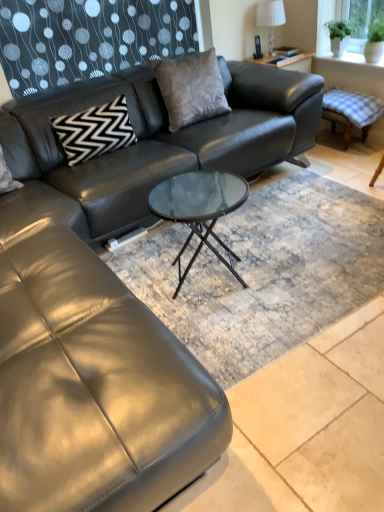
At what (x,y) coordinates should I click in order to perform the action: click on white fabric lampshade at upper right. Please return your answer as a coordinate pair (x, y). This screenshot has width=384, height=512. Looking at the image, I should click on pos(270,18).

What do you see at coordinates (350, 111) in the screenshot? I see `checkered fabric swivel chair at right` at bounding box center [350, 111].

Image resolution: width=384 pixels, height=512 pixels. What do you see at coordinates (191, 88) in the screenshot?
I see `satin gray pillow at center, which ranks as the first pillow in right-to-left order` at bounding box center [191, 88].

Image resolution: width=384 pixels, height=512 pixels. I want to click on green glass window screen at upper right, so click(x=362, y=15).

What do you see at coordinates (94, 131) in the screenshot?
I see `black zigzag-patterned pillow at upper left, positioned as the 1th pillow in left-to-right order` at bounding box center [94, 131].

Where is `white fabric lampshade at upper right`? The height and width of the screenshot is (512, 384). white fabric lampshade at upper right is located at coordinates (270, 18).

Is white fabric lampshade at upper right outside of satin gray pillow at center, which ranks as the first pillow in right-to-left order?

Yes, white fabric lampshade at upper right is outside of satin gray pillow at center, which ranks as the first pillow in right-to-left order.

Between white fabric lampshade at upper right and satin gray pillow at center, which appears as the 2th pillow when viewed from the left, which one has smaller size?

white fabric lampshade at upper right is smaller.

Can you confirm if white fabric lampshade at upper right is shorter than satin gray pillow at center, which appears as the 2th pillow when viewed from the left?

Correct, white fabric lampshade at upper right is not as tall as satin gray pillow at center, which appears as the 2th pillow when viewed from the left.

In the scene shown: Is white fabric lampshade at upper right oriented towards satin gray pillow at center, which appears as the 2th pillow when viewed from the left?

No, white fabric lampshade at upper right is not aimed at satin gray pillow at center, which appears as the 2th pillow when viewed from the left.

From a real-world perspective, is green glass window screen at upper right physically located above or below white fabric lampshade at upper right?

green glass window screen at upper right is situated lower than white fabric lampshade at upper right in the real world.

From their relative heights in the image, would you say green glass window screen at upper right is taller or shorter than white fabric lampshade at upper right?

Considering their sizes, green glass window screen at upper right has less height than white fabric lampshade at upper right.

From the image's perspective, who appears lower, green glass window screen at upper right or white fabric lampshade at upper right?

green glass window screen at upper right.

Is green glass window screen at upper right not within white fabric lampshade at upper right?

Yes, green glass window screen at upper right is located beyond the bounds of white fabric lampshade at upper right.

Is point (267, 7) closer or farther from the camera than point (358, 24)?

Point (267, 7) is positioned farther from the camera compared to point (358, 24).

Considering the sizes of white fabric lampshade at upper right and green glass window screen at upper right in the image, is white fabric lampshade at upper right wider or thinner than green glass window screen at upper right?

Considering their sizes, white fabric lampshade at upper right looks broader than green glass window screen at upper right.

Considering the positions of objects checkered fabric swivel chair at right and satin gray pillow at center, which appears as the 2th pillow when viewed from the left, in the image provided, who is more to the right, checkered fabric swivel chair at right or satin gray pillow at center, which appears as the 2th pillow when viewed from the left,?

checkered fabric swivel chair at right is more to the right.

Which is behind, checkered fabric swivel chair at right or satin gray pillow at center, which ranks as the first pillow in right-to-left order?

checkered fabric swivel chair at right.

Is checkered fabric swivel chair at right next to satin gray pillow at center, which ranks as the first pillow in right-to-left order, and touching it?

checkered fabric swivel chair at right and satin gray pillow at center, which ranks as the first pillow in right-to-left order, are not in contact.

The height and width of the screenshot is (512, 384). I want to click on swivel chair below the satin gray pillow at center, which appears as the 2th pillow when viewed from the left (from the image's perspective), so click(x=350, y=111).

Is black zigzag-patterned pillow at upper left, positioned as the 1th pillow in left-to-right order, to the right of checkered fabric swivel chair at right from the viewer's perspective?

In fact, black zigzag-patterned pillow at upper left, positioned as the 1th pillow in left-to-right order, is to the left of checkered fabric swivel chair at right.

Who is shorter, black zigzag-patterned pillow at upper left, marked as the 2th pillow in a right-to-left arrangement, or checkered fabric swivel chair at right?

Standing shorter between the two is checkered fabric swivel chair at right.

Choose the correct answer: Is black zigzag-patterned pillow at upper left, marked as the 2th pillow in a right-to-left arrangement, inside checkered fabric swivel chair at right or outside it?

black zigzag-patterned pillow at upper left, marked as the 2th pillow in a right-to-left arrangement, is outside checkered fabric swivel chair at right.

Measure the distance between black zigzag-patterned pillow at upper left, positioned as the 1th pillow in left-to-right order, and checkered fabric swivel chair at right.

The distance of black zigzag-patterned pillow at upper left, positioned as the 1th pillow in left-to-right order, from checkered fabric swivel chair at right is 1.72 meters.

In the scene shown: From a real-world perspective, between checkered fabric swivel chair at right and black zigzag-patterned pillow at upper left, marked as the 2th pillow in a right-to-left arrangement, who is vertically lower?

From a 3D spatial view, checkered fabric swivel chair at right is below.

Which is more to the right, checkered fabric swivel chair at right or black zigzag-patterned pillow at upper left, positioned as the 1th pillow in left-to-right order?

From the viewer's perspective, checkered fabric swivel chair at right appears more on the right side.

Is checkered fabric swivel chair at right oriented towards black zigzag-patterned pillow at upper left, marked as the 2th pillow in a right-to-left arrangement?

Yes.

Does point (308, 54) lie in front of point (167, 81)?

No.

From a real-world perspective, is matte black side table at upper right beneath satin gray pillow at center, which ranks as the first pillow in right-to-left order?

Indeed, from a real-world perspective, matte black side table at upper right is positioned beneath satin gray pillow at center, which ranks as the first pillow in right-to-left order.

How much distance is there between matte black side table at upper right and satin gray pillow at center, which appears as the 2th pillow when viewed from the left?

matte black side table at upper right is 33.54 inches away from satin gray pillow at center, which appears as the 2th pillow when viewed from the left.

Is matte black side table at upper right with satin gray pillow at center, which appears as the 2th pillow when viewed from the left?

No, matte black side table at upper right is not next to satin gray pillow at center, which appears as the 2th pillow when viewed from the left.

From a real-world perspective, count 1st pillows downward from the white fabric lampshade at upper right and point to it. Please provide its 2D coordinates.

[(191, 88)]

Image resolution: width=384 pixels, height=512 pixels. I want to click on lamp lying behind the green glass window screen at upper right, so [270, 18].

From the image, which object appears to be farther from satin gray pillow at center, which ranks as the first pillow in right-to-left order, white fabric lampshade at upper right or black zigzag-patterned pillow at upper left, marked as the 2th pillow in a right-to-left arrangement?

The object further to satin gray pillow at center, which ranks as the first pillow in right-to-left order, is white fabric lampshade at upper right.

Looking at the image, which one is located further to satin gray pillow at center, which ranks as the first pillow in right-to-left order, matte black side table at upper right or checkered fabric swivel chair at right?

checkered fabric swivel chair at right.

Considering their positions, is satin gray pillow at center, which ranks as the first pillow in right-to-left order, positioned further to white fabric lampshade at upper right than checkered fabric swivel chair at right?

Based on the image, satin gray pillow at center, which ranks as the first pillow in right-to-left order, appears to be further to white fabric lampshade at upper right.

Estimate the real-world distances between objects in this image. Which object is further from white fabric lampshade at upper right, checkered fabric swivel chair at right or matte black side table at upper right?

checkered fabric swivel chair at right is further to white fabric lampshade at upper right.

Based on their spatial positions, is satin gray pillow at center, which ranks as the first pillow in right-to-left order, or white fabric lampshade at upper right closer to black zigzag-patterned pillow at upper left, positioned as the 1th pillow in left-to-right order?

The object closer to black zigzag-patterned pillow at upper left, positioned as the 1th pillow in left-to-right order, is satin gray pillow at center, which ranks as the first pillow in right-to-left order.

Estimate the real-world distances between objects in this image. Which object is closer to white fabric lampshade at upper right, green glass window screen at upper right or satin gray pillow at center, which ranks as the first pillow in right-to-left order?

Among the two, green glass window screen at upper right is located nearer to white fabric lampshade at upper right.

Which object lies nearer to the anchor point satin gray pillow at center, which ranks as the first pillow in right-to-left order, matte black side table at upper right or white fabric lampshade at upper right?

Among the two, matte black side table at upper right is located nearer to satin gray pillow at center, which ranks as the first pillow in right-to-left order.

From the image, which object appears to be nearer to satin gray pillow at center, which ranks as the first pillow in right-to-left order, black zigzag-patterned pillow at upper left, positioned as the 1th pillow in left-to-right order, or checkered fabric swivel chair at right?

Based on the image, black zigzag-patterned pillow at upper left, positioned as the 1th pillow in left-to-right order, appears to be nearer to satin gray pillow at center, which ranks as the first pillow in right-to-left order.

Find the location of a particular element. This screenshot has height=512, width=384. pillow situated between black zigzag-patterned pillow at upper left, positioned as the 1th pillow in left-to-right order, and green glass window screen at upper right from left to right is located at coordinates (191, 88).

I want to click on window screen between matte black side table at upper right and checkered fabric swivel chair at right in the up-down direction, so click(362, 15).

Locate an element on the screen. lamp between black zigzag-patterned pillow at upper left, marked as the 2th pillow in a right-to-left arrangement, and green glass window screen at upper right from left to right is located at coordinates (270, 18).

The width and height of the screenshot is (384, 512). What are the coordinates of `side table situated between satin gray pillow at center, which ranks as the first pillow in right-to-left order, and checkered fabric swivel chair at right from left to right` in the screenshot? It's located at pos(288,61).